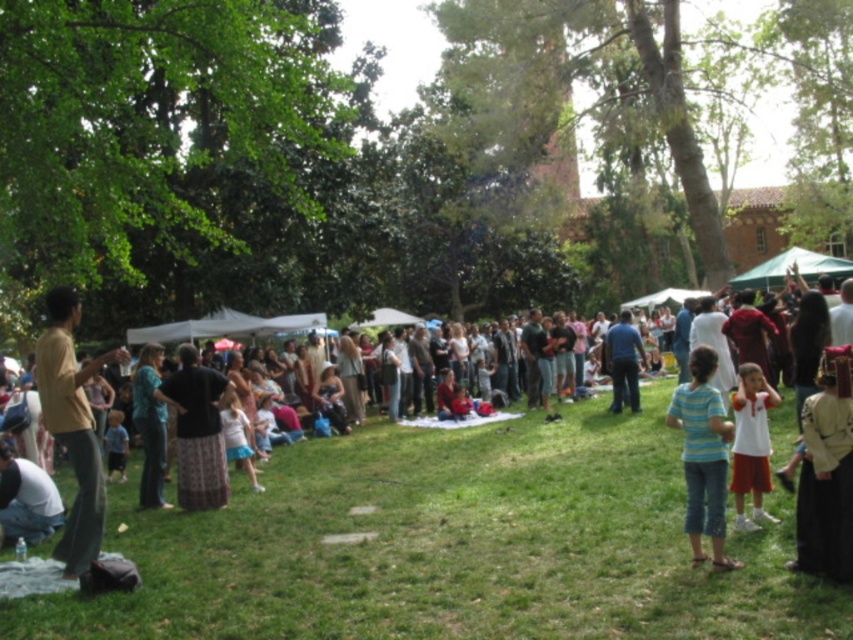
Between patterned fabric skirt at center and teal fabric shirt at center, which one has more height?

teal fabric shirt at center is taller.

Can you confirm if patterned fabric skirt at center is wider than teal fabric shirt at center?

No.

Who is more forward, (201, 388) or (149, 348)?

Positioned in front is point (201, 388).

In order to click on patterned fabric skirt at center in this screenshot , I will do `click(196, 432)`.

Based on the photo, can you confirm if light brown cotton shirt at left is positioned below white cotton shirt at lower left?

Actually, light brown cotton shirt at left is above white cotton shirt at lower left.

Is light brown cotton shirt at left to the left of white cotton shirt at lower left from the viewer's perspective?

Indeed, light brown cotton shirt at left is positioned on the left side of white cotton shirt at lower left.

Is point (70, 310) positioned after point (55, 528)?

No.

What are the coordinates of `light brown cotton shirt at left` in the screenshot? It's located at (73, 426).

Does white textured dress at lower right have a greater width compared to striped t-shirt at center?

In fact, white textured dress at lower right might be narrower than striped t-shirt at center.

Does white textured dress at lower right appear on the left side of striped t-shirt at center?

Incorrect, white textured dress at lower right is not on the left side of striped t-shirt at center.

Between point (850, 387) and point (708, 384), which one is positioned behind?

Point (708, 384)

Find the location of a particular element. white textured dress at lower right is located at coordinates click(x=827, y=472).